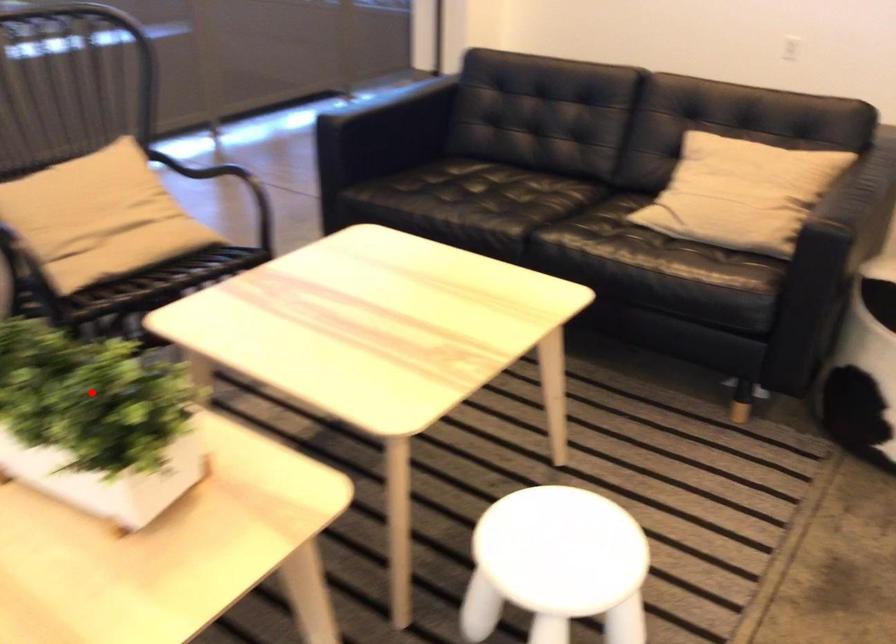
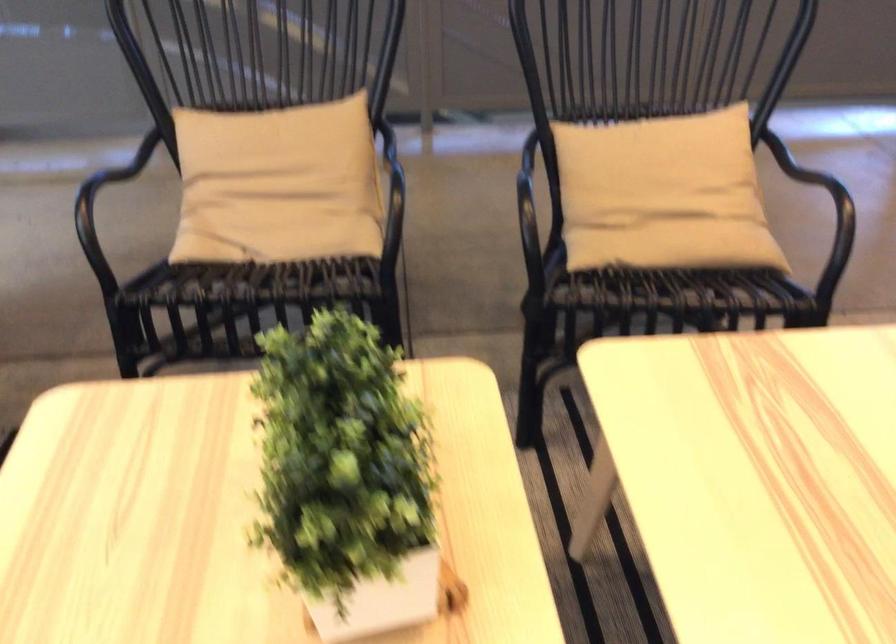
Question: I am providing you with two images of the same scene from different viewpoints. A red point is shown in image1. For the corresponding object point in image2, is it positioned nearer or farther from the camera?

Choices:
 (A) Nearer
 (B) Farther

Answer: (A)